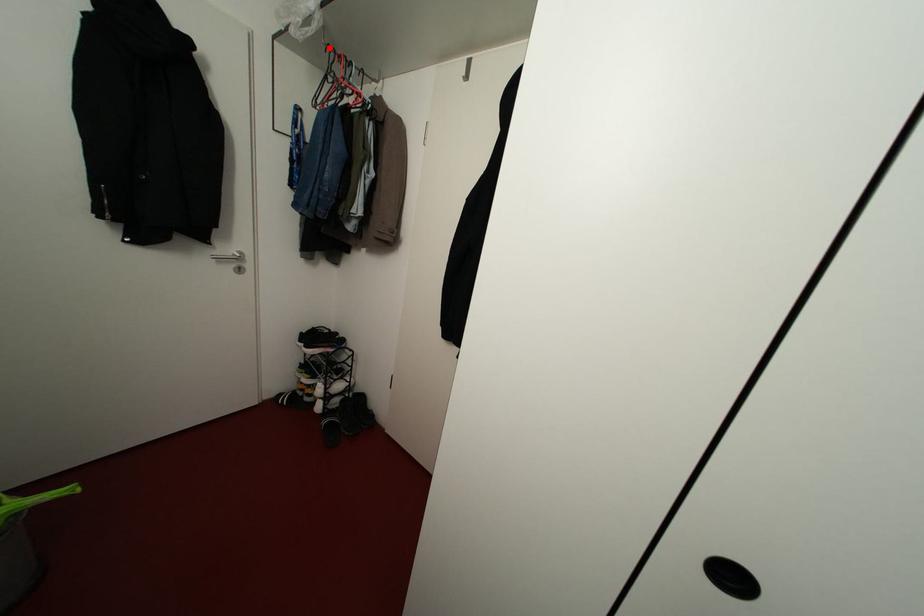
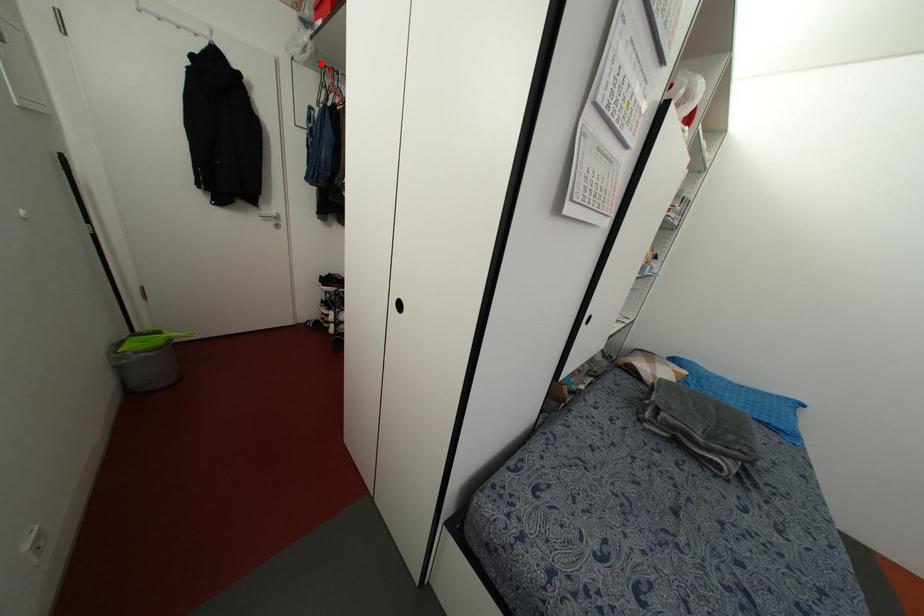
I am providing you with two images of the same scene from different viewpoints. A red point is marked on the first image and another point is marked on the second image. Is the marked point in image1 the same physical position as the marked point in image2?

Yes